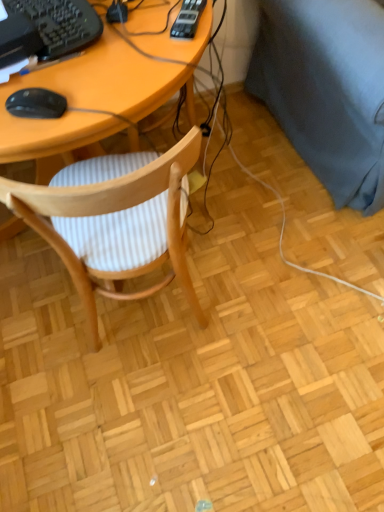
Question: Should I look upward or downward to see black plastic keyboard at upper left?

Choices:
 (A) down
 (B) up

Answer: (B)

Question: Is dark blue fabric couch at right oriented away from black plastic keyboard at upper left?

Choices:
 (A) yes
 (B) no

Answer: (B)

Question: Considering the relative sizes of dark blue fabric couch at right and black plastic keyboard at upper left in the image provided, is dark blue fabric couch at right thinner than black plastic keyboard at upper left?

Choices:
 (A) no
 (B) yes

Answer: (A)

Question: Is dark blue fabric couch at right shorter than black plastic keyboard at upper left?

Choices:
 (A) no
 (B) yes

Answer: (A)

Question: Could you tell me if dark blue fabric couch at right is turned towards black plastic keyboard at upper left?

Choices:
 (A) no
 (B) yes

Answer: (A)

Question: Considering the relative positions of dark blue fabric couch at right and black plastic keyboard at upper left in the image provided, is dark blue fabric couch at right to the left of black plastic keyboard at upper left from the viewer's perspective?

Choices:
 (A) no
 (B) yes

Answer: (A)

Question: From the image's perspective, is dark blue fabric couch at right located beneath black plastic keyboard at upper left?

Choices:
 (A) yes
 (B) no

Answer: (B)

Question: Is the depth of dark blue fabric couch at right less than that of wooden chair with striped cushion at center?

Choices:
 (A) no
 (B) yes

Answer: (A)

Question: Could wooden chair with striped cushion at center be considered to be inside dark blue fabric couch at right?

Choices:
 (A) no
 (B) yes

Answer: (A)

Question: From the image's perspective, is dark blue fabric couch at right on wooden chair with striped cushion at center?

Choices:
 (A) no
 (B) yes

Answer: (B)

Question: Does dark blue fabric couch at right appear on the right side of wooden chair with striped cushion at center?

Choices:
 (A) no
 (B) yes

Answer: (B)

Question: Considering the relative sizes of dark blue fabric couch at right and wooden chair with striped cushion at center in the image provided, is dark blue fabric couch at right wider than wooden chair with striped cushion at center?

Choices:
 (A) yes
 (B) no

Answer: (A)

Question: Can you see dark blue fabric couch at right touching wooden chair with striped cushion at center?

Choices:
 (A) no
 (B) yes

Answer: (A)

Question: Can you confirm if black matte mouse at left is taller than dark blue fabric couch at right?

Choices:
 (A) yes
 (B) no

Answer: (B)